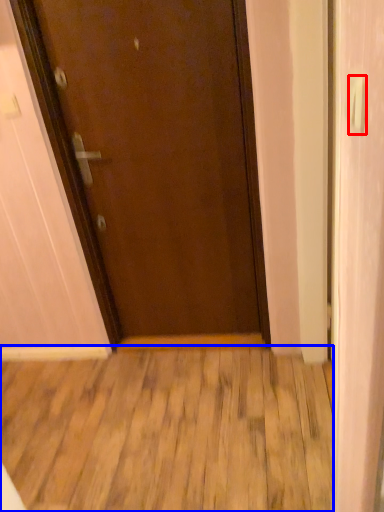
Question: Which of the following is the closest to the observer, door handle (highlighted by a red box) or wood (highlighted by a blue box)?

Choices:
 (A) door handle
 (B) wood

Answer: (A)